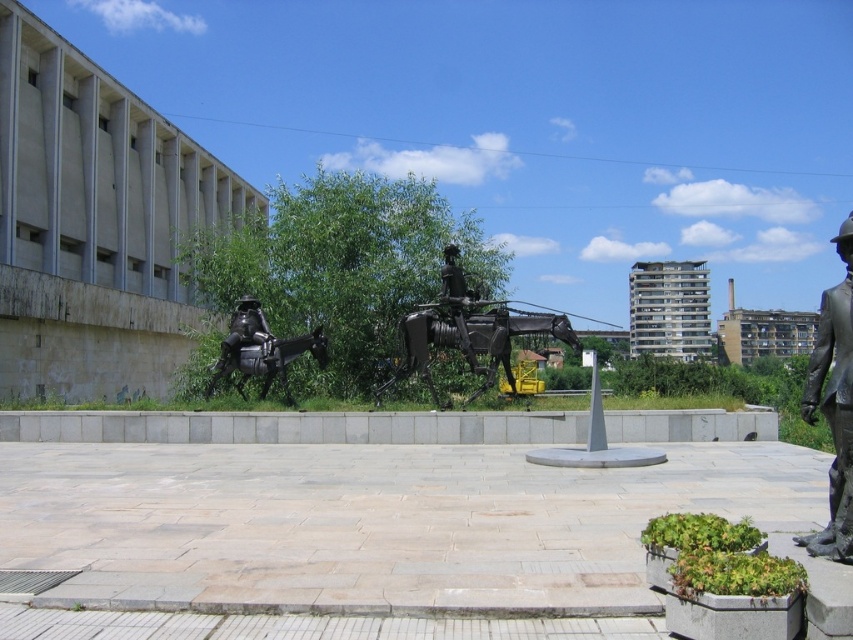
Question: Observing the image, what is the correct spatial positioning of bronze horse and rider at center in reference to shiny black horse at center?

Choices:
 (A) right
 (B) left

Answer: (A)

Question: Which is farther from the shiny black horse at center?

Choices:
 (A) bronze statue at right
 (B) shiny black robot at lower left
 (C) bronze horse and rider at center

Answer: (A)

Question: Is bronze statue at right closer to camera compared to shiny black robot at lower left?

Choices:
 (A) no
 (B) yes

Answer: (B)

Question: Which of these objects is positioned farthest from the bronze horse and rider at center?

Choices:
 (A) bronze statue at right
 (B) shiny black robot at lower left

Answer: (A)

Question: Is bronze horse and rider at center in front of bronze statue at right?

Choices:
 (A) no
 (B) yes

Answer: (A)

Question: Which object is positioned farthest from the bronze statue at right?

Choices:
 (A) shiny black robot at lower left
 (B) shiny black horse at center

Answer: (A)